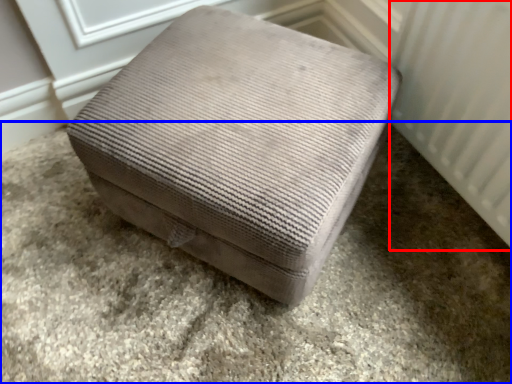
Question: Which object is closer to the camera taking this photo, radiator (highlighted by a red box) or concrete (highlighted by a blue box)?

Choices:
 (A) radiator
 (B) concrete

Answer: (A)